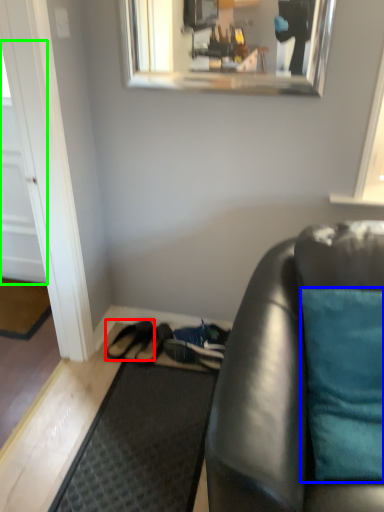
Question: Based on their relative distances, which object is nearer to footwear (highlighted by a red box)? Choose from pillow (highlighted by a blue box) and door (highlighted by a green box).

Choices:
 (A) pillow
 (B) door

Answer: (B)